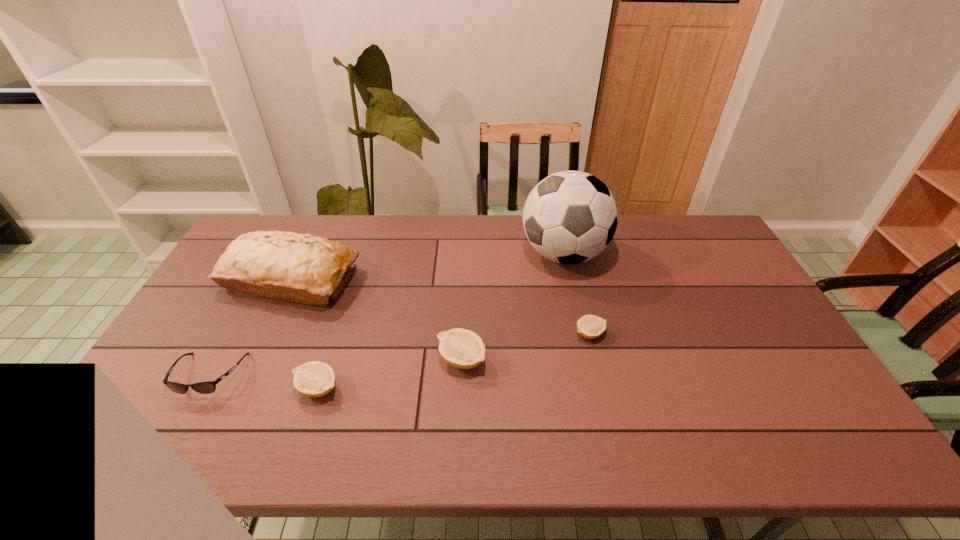
The width and height of the screenshot is (960, 540). Find the location of `lemon that is the closest one to the bread`. lemon that is the closest one to the bread is located at coordinates (313, 379).

Identify the location of vacant space that satisfies the following two spatial constraints: 1. on the main logo of the tallest object; 2. on the front-facing side of the sunglasses. (590, 375).

Find the location of a particular element. Image resolution: width=960 pixels, height=540 pixels. vacant area in the image that satisfies the following two spatial constraints: 1. on the main logo of the soccer ball; 2. on the right side of the rightmost lemon is located at coordinates (582, 334).

Find the location of a particular element. The height and width of the screenshot is (540, 960). vacant position in the image that satisfies the following two spatial constraints: 1. on the front-facing side of the sunglasses; 2. on the right side of the leftmost lemon is located at coordinates (203, 388).

What are the coordinates of `blank area in the image that satisfies the following two spatial constraints: 1. on the main logo of the tallest object; 2. on the front-facing side of the sunglasses` in the screenshot? It's located at (x=590, y=375).

At what (x,y) coordinates should I click in order to perform the action: click on vacant area in the image that satisfies the following two spatial constraints: 1. on the main logo of the rightmost lemon; 2. on the right side of the soccer ball. Please return your answer as a coordinate pair (x, y). Looking at the image, I should click on (582, 334).